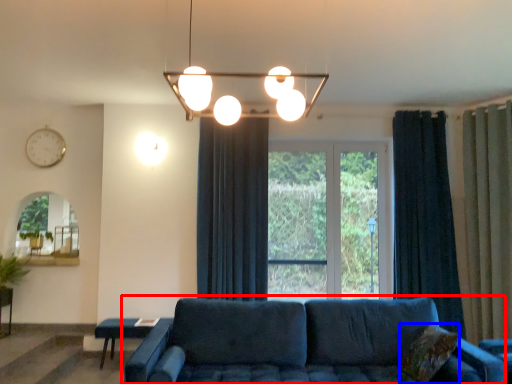
Question: Which point is further to the camera, studio couch (highlighted by a red box) or pillow (highlighted by a blue box)?

Choices:
 (A) studio couch
 (B) pillow

Answer: (B)